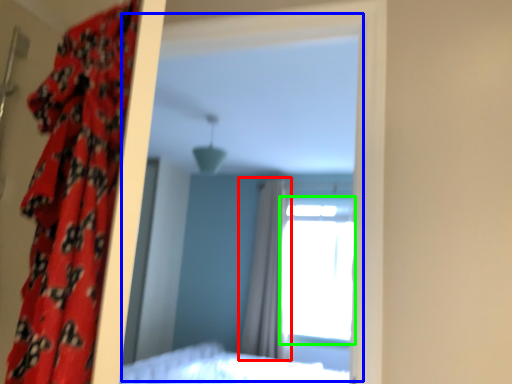
Question: Considering the real-world distances, which object is farthest from curtain (highlighted by a red box)? mirror (highlighted by a blue box) or window (highlighted by a green box)?

Choices:
 (A) mirror
 (B) window

Answer: (A)